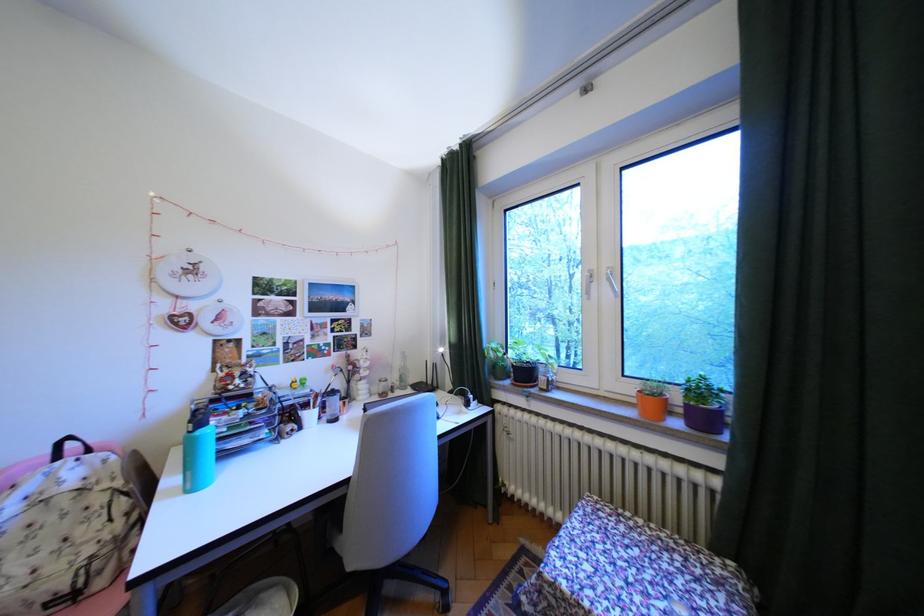
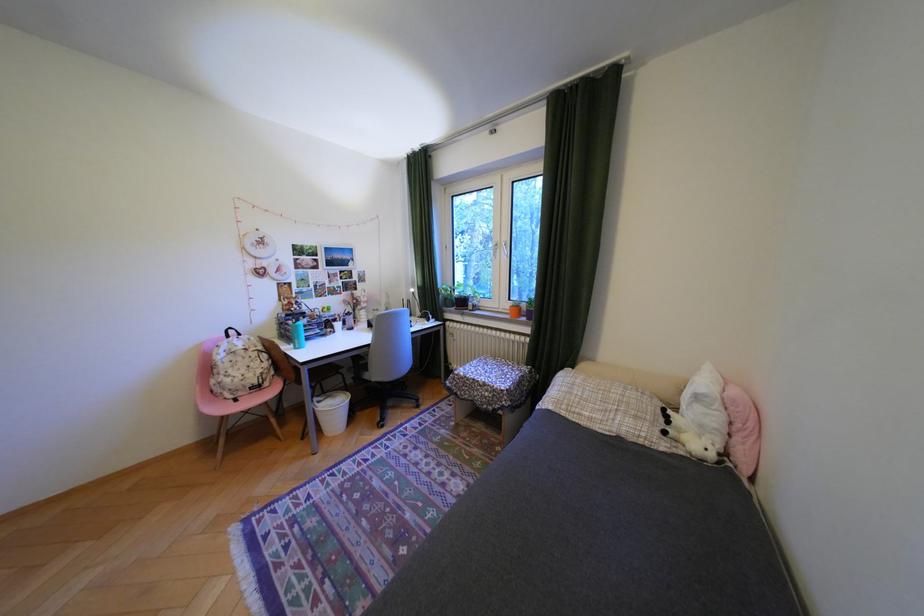
Question: What movement of the cameraman would produce the second image?

Choices:
 (A) Left
 (B) Right
 (C) Forward
 (D) Backward

Answer: (D)